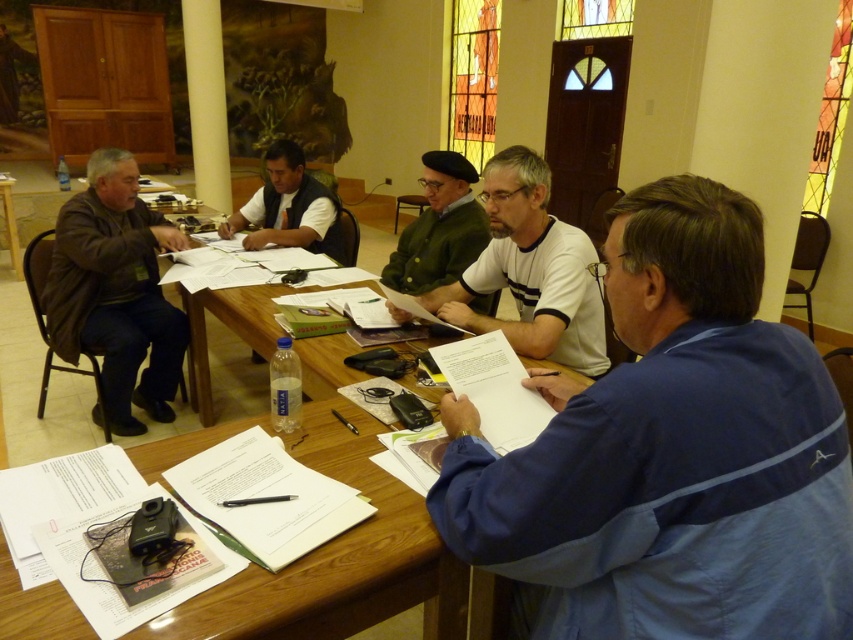
You are a delivery person who needs to place a small package between the blue fabric shirt at center and the green matte jacket at center. The package is 1.5 meters long. Will it fit between them?

The distance between the blue fabric shirt at center and the green matte jacket at center is 1.24 meters. Since the package is 1.5 meters long, it is longer than the available space, so it will not fit between them.

You are standing in the room and want to reach a specific point marked at coordinates point (457, 289). If your height is 1.7 meters, can you see the point from your current position without moving?

The distance of point (457, 289) from viewer is 2.28 meters. Since the point is at a distance of 2.28 meters and your height is 1.7 meters, you can see the point as long as there are no obstructions between you and the point.

You are sitting at the wooden table in the meeting room. You need to reach the point labeled as point (x=595, y=285). Is this point closer to you than the point labeled as point (x=10, y=180)?

Yes, the point labeled as point (x=595, y=285) is in front of point labeled as point (x=10, y=180), so it is closer to you.